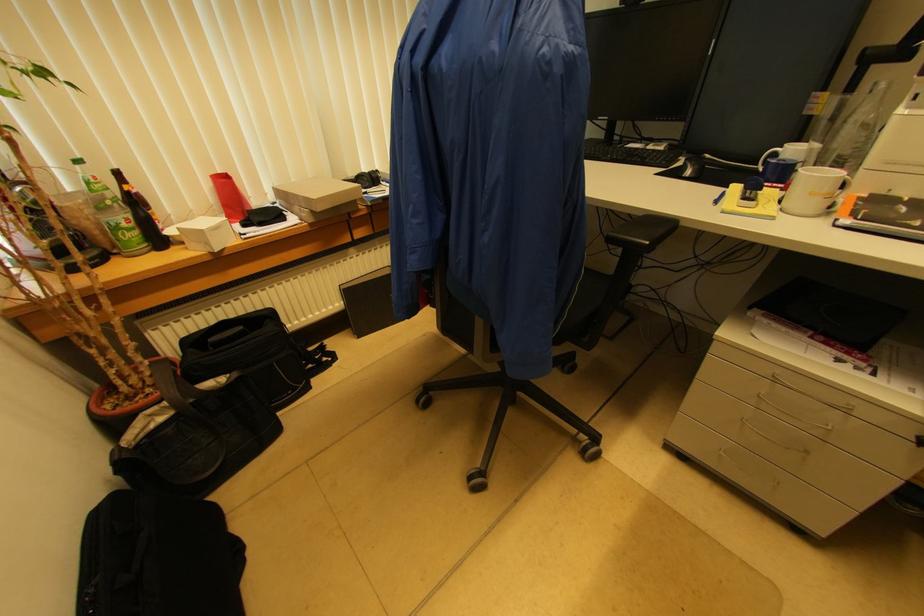
Find where to lift the small white box. Please return your answer as a coordinate pair (x, y).

(205, 233)